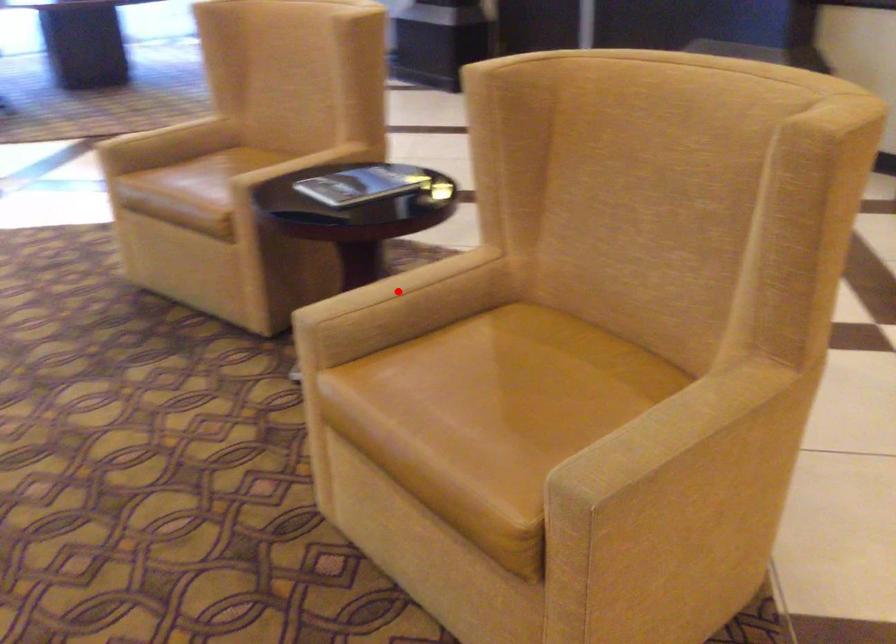
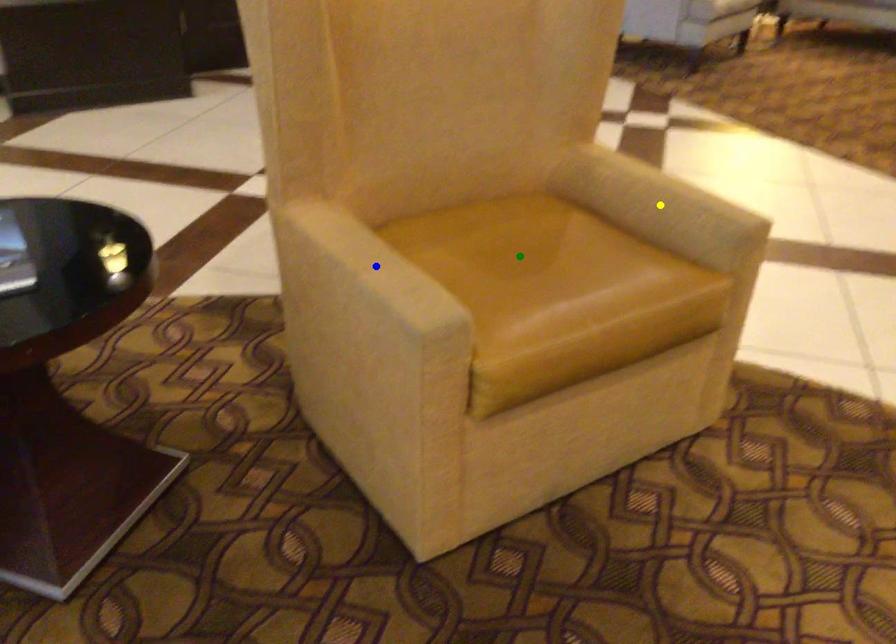
Question: I am providing you with two images of the same scene from different viewpoints. A red point is marked on the first image. You are given multiple points on the second image. Which point in image 2 represents the same 3d spot as the red point in image 1?

Choices:
 (A) blue point
 (B) yellow point
 (C) green point

Answer: (A)